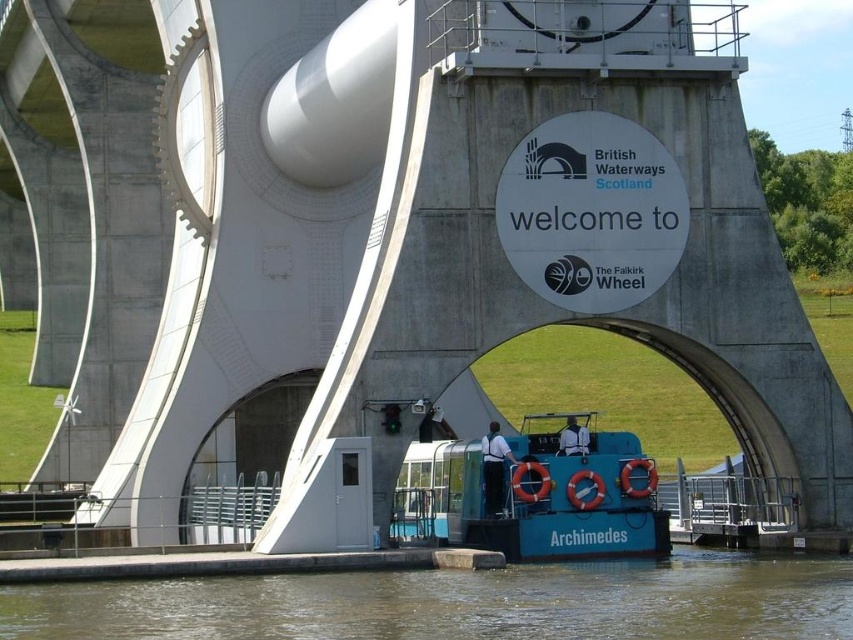
Is brown murky water at lower center shorter than blue rubber boat at center?

Yes, brown murky water at lower center is shorter than blue rubber boat at center.

Which is in front, point (614, 621) or point (647, 484)?

Point (614, 621)

The image size is (853, 640). I want to click on brown murky water at lower center, so click(461, 602).